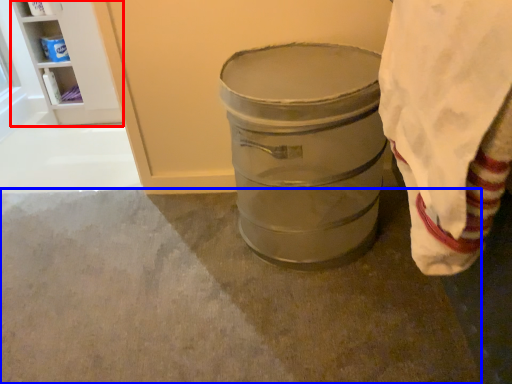
Question: Among these objects, which one is farthest to the camera, shelf (highlighted by a red box) or concrete (highlighted by a blue box)?

Choices:
 (A) shelf
 (B) concrete

Answer: (A)